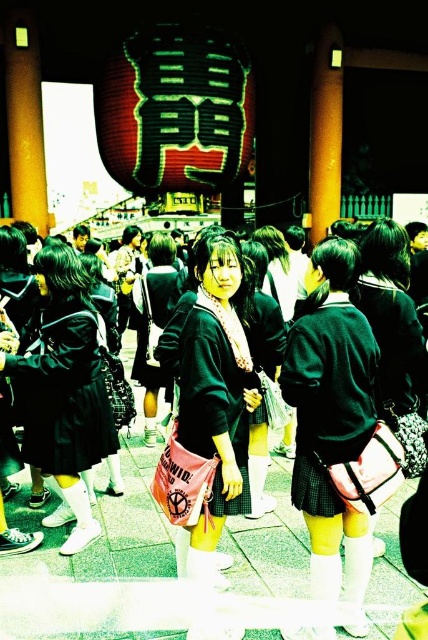
You are a photographer trying to capture the students in the foreground without overcrowding the frame. Given that the matte green uniform at center and the green plaid skirt at center are both in the center, which one would you focus on to ensure the subject fits better within the frame?

The matte green uniform at center is narrower than the green plaid skirt at center, so focusing on the matte green uniform at center would allow it to fit better within the frame without overcrowding.

Consider the image. You are a photographer standing in the plaza and want to take a photo of the shiny red paper lantern at upper center without the matte green uniform at center blocking it. What should you do?

Move your position so that the shiny red paper lantern at upper center is no longer behind the matte green uniform at center. Since the matte green uniform at center is in front of the shiny red paper lantern at upper center, adjusting your angle or moving to a different spot will allow you to capture the lantern without obstruction.